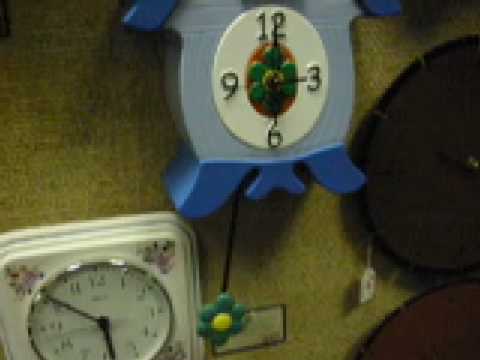
Locate an element on the screen. The width and height of the screenshot is (480, 360). wall is located at coordinates (81, 166).